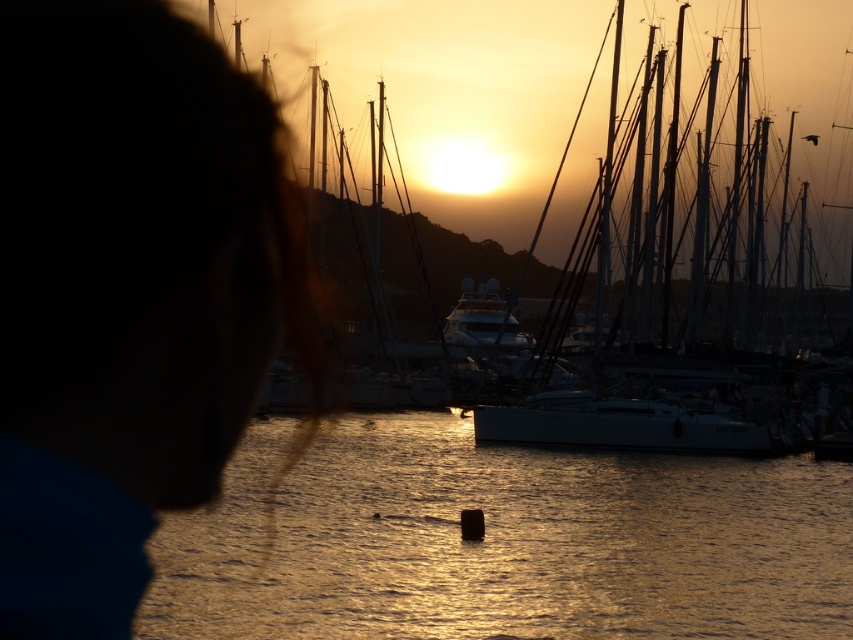
Question: Estimate the real-world distances between objects in this image. Which object is farther from the glossy water at center?

Choices:
 (A) silky blue hair at upper left
 (B) white matte sailboat at center

Answer: (A)

Question: In this image, where is silky blue hair at upper left located relative to white matte sailboat at center?

Choices:
 (A) left
 (B) right

Answer: (A)

Question: Among these points, which one is nearest to the camera?

Choices:
 (A) (213, 416)
 (B) (695, 429)
 (C) (393, 630)

Answer: (A)

Question: Which point is closer to the camera?

Choices:
 (A) (495, 460)
 (B) (33, 460)
 (C) (769, 424)

Answer: (B)

Question: Does silky blue hair at upper left come behind white matte sailboat at center?

Choices:
 (A) yes
 (B) no

Answer: (B)

Question: In this image, where is silky blue hair at upper left located relative to glossy water at center?

Choices:
 (A) left
 (B) right

Answer: (A)